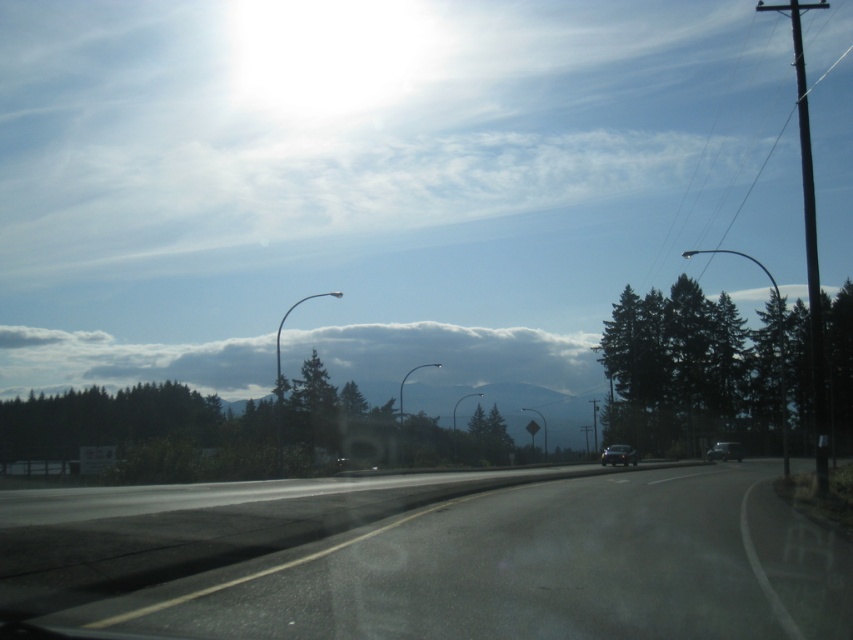
Is point (759, 401) farther from viewer compared to point (625, 451)?

Yes.

Who is taller, green matte tree at right or shiny black sedan at center?

With more height is green matte tree at right.

Which is behind, point (741, 337) or point (608, 449)?

Positioned behind is point (741, 337).

Where is `green matte tree at right`? Image resolution: width=853 pixels, height=640 pixels. green matte tree at right is located at coordinates (688, 365).

Is shiny black sedan at center taller than shiny silver sedan at right?

Indeed, shiny black sedan at center has a greater height compared to shiny silver sedan at right.

Is shiny black sedan at center positioned behind shiny silver sedan at right?

That is False.

Does point (608, 445) come in front of point (730, 445)?

No, (608, 445) is behind (730, 445).

Where is `shiny black sedan at center`? shiny black sedan at center is located at coordinates (618, 456).

Does asphalt road at center have a lesser height compared to shiny silver sedan at right?

Incorrect, asphalt road at center's height does not fall short of shiny silver sedan at right's.

Between asphalt road at center and shiny silver sedan at right, which one has less height?

Standing shorter between the two is shiny silver sedan at right.

Which is behind, point (755, 500) or point (730, 448)?

The point (730, 448) is behind.

At what (x,y) coordinates should I click in order to perform the action: click on asphalt road at center. Please return your answer as a coordinate pair (x, y). Looking at the image, I should click on (432, 557).